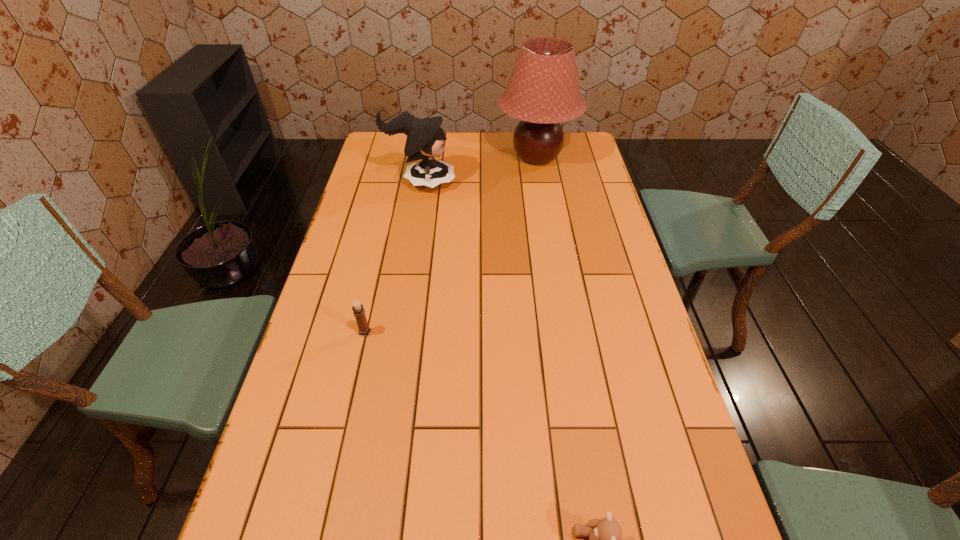
I want to click on lampshade, so pos(543,90).

The width and height of the screenshot is (960, 540). What are the coordinates of `doll` in the screenshot? It's located at (425, 137).

Identify the location of the third tallest object. Image resolution: width=960 pixels, height=540 pixels. (359, 312).

I want to click on candle holder, so point(359,312).

Where is `blank space located on the front-facing side of the tallest object`? blank space located on the front-facing side of the tallest object is located at coordinates (468, 157).

Locate an element on the screen. This screenshot has height=540, width=960. free space located on the front-facing side of the tallest object is located at coordinates (464, 157).

The height and width of the screenshot is (540, 960). Find the location of `free location located on the front-facing side of the tallest object`. free location located on the front-facing side of the tallest object is located at coordinates (464, 157).

Image resolution: width=960 pixels, height=540 pixels. What are the coordinates of `vacant space located 0.390m at the face of the second tallest object` in the screenshot? It's located at (559, 183).

You are a GUI agent. You are given a task and a screenshot of the screen. Output one action in this format:
    pyautogui.click(x=<x>, y=<y>)
    Task: Click on the free spot located on the front of the second shortest object
    The width and height of the screenshot is (960, 540).
    Given the screenshot: What is the action you would take?
    pyautogui.click(x=352, y=388)

At what (x,y) coordinates should I click in order to perform the action: click on object located in the far edge section of the desktop. Please return your answer as a coordinate pair (x, y). Image resolution: width=960 pixels, height=540 pixels. Looking at the image, I should click on (543, 90).